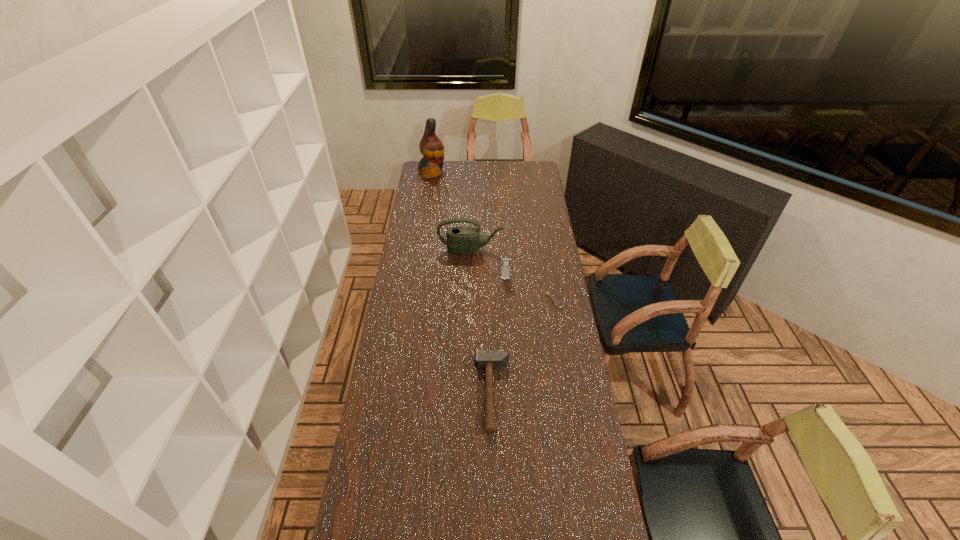
Find the location of a particular element. The width and height of the screenshot is (960, 540). free location located on the face of the farthest object is located at coordinates [472, 173].

You are a GUI agent. You are given a task and a screenshot of the screen. Output one action in this format:
    pyautogui.click(x=<x>, y=<y>)
    Task: Click on the blank space located 0.270m on the spout of the fourth shortest object
    The height and width of the screenshot is (540, 960).
    Given the screenshot: What is the action you would take?
    [469, 295]

This screenshot has height=540, width=960. Identify the location of free space located on the front-facing side of the third tallest object. tap(509, 336).

Find the location of a particular element. This screenshot has height=540, width=960. blank area located 0.320m on the striking surface of the fourth tallest object is located at coordinates tap(386, 394).

At what (x,y) coordinates should I click in order to perform the action: click on free region located on the striking surface of the fourth tallest object. Please return your answer as a coordinate pair (x, y). The height and width of the screenshot is (540, 960). Looking at the image, I should click on (452, 394).

This screenshot has width=960, height=540. In order to click on free space located 0.280m on the striking surface of the fourth tallest object in this screenshot , I will do `click(397, 394)`.

Where is `free space located on the front of the rightmost object`? free space located on the front of the rightmost object is located at coordinates pos(567,380).

Locate an element on the screen. object positioned at the far edge is located at coordinates (431, 147).

Identify the location of object situated at the left edge. This screenshot has height=540, width=960. (431, 147).

Identify the location of object that is at the right edge. This screenshot has width=960, height=540. (558, 304).